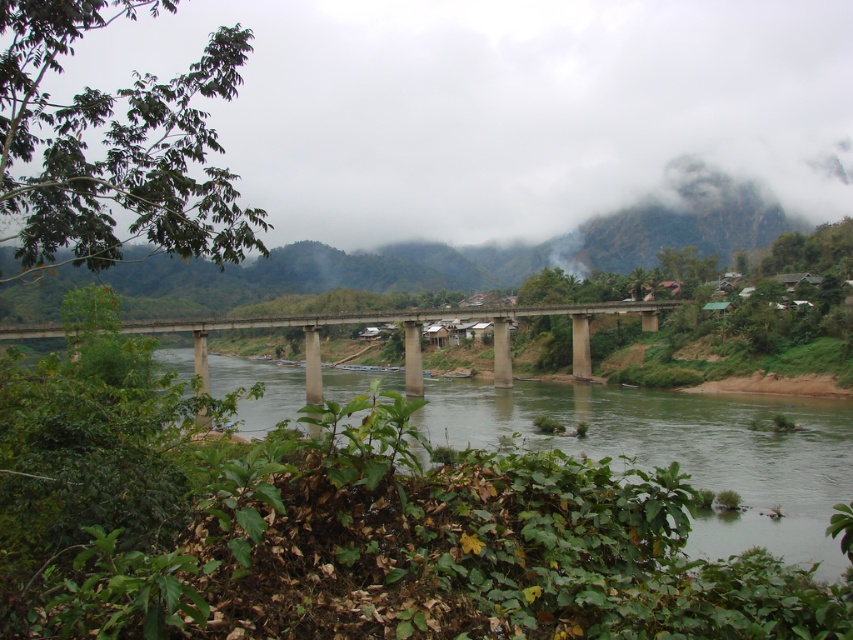
Question: Estimate the real-world distances between objects in this image. Which object is farther from the white fluffy cloud at upper center?

Choices:
 (A) green grassy river at center
 (B) concrete bridge at center

Answer: (B)

Question: Is white fluffy cloud at upper center bigger than green grassy river at center?

Choices:
 (A) no
 (B) yes

Answer: (B)

Question: Considering the real-world distances, which object is closest to the green grassy river at center?

Choices:
 (A) concrete bridge at center
 (B) white fluffy cloud at upper center

Answer: (A)

Question: Estimate the real-world distances between objects in this image. Which object is closer to the white fluffy cloud at upper center?

Choices:
 (A) concrete bridge at center
 (B) green grassy river at center

Answer: (B)

Question: Is green grassy river at center bigger than concrete bridge at center?

Choices:
 (A) yes
 (B) no

Answer: (A)

Question: Can you confirm if green grassy river at center is thinner than concrete bridge at center?

Choices:
 (A) yes
 (B) no

Answer: (B)